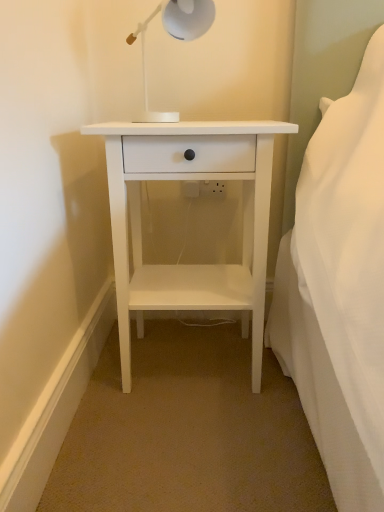
Question: Is white plastic lamp at upper center taller or shorter than white matte nightstand at center?

Choices:
 (A) short
 (B) tall

Answer: (A)

Question: Would you say white plastic lamp at upper center is to the left or to the right of white matte nightstand at center in the picture?

Choices:
 (A) left
 (B) right

Answer: (A)

Question: From a real-world perspective, is white plastic lamp at upper center above or below white matte nightstand at center?

Choices:
 (A) above
 (B) below

Answer: (A)

Question: From a real-world perspective, is white matte nightstand at center above or below white plastic lamp at upper center?

Choices:
 (A) below
 (B) above

Answer: (A)

Question: In terms of height, does white matte nightstand at center look taller or shorter compared to white plastic lamp at upper center?

Choices:
 (A) short
 (B) tall

Answer: (B)

Question: Is white matte nightstand at center in front of or behind white plastic lamp at upper center in the image?

Choices:
 (A) behind
 (B) front

Answer: (A)

Question: Is white matte nightstand at center spatially inside white plastic lamp at upper center, or outside of it?

Choices:
 (A) inside
 (B) outside

Answer: (B)